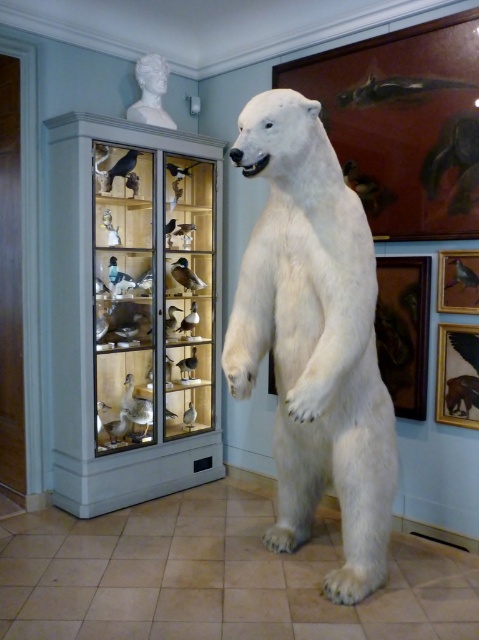
Question: Is white fur polar bear at center further to camera compared to white marble bust at upper center?

Choices:
 (A) no
 (B) yes

Answer: (A)

Question: Is white fur polar bear at center closer to the viewer compared to white marble bust at upper center?

Choices:
 (A) yes
 (B) no

Answer: (A)

Question: Is white fur polar bear at center smaller than white marble bust at upper center?

Choices:
 (A) no
 (B) yes

Answer: (A)

Question: Which point is closer to the camera?

Choices:
 (A) white marble bust at upper center
 (B) white fur polar bear at center

Answer: (B)

Question: Which point is closer to the camera?

Choices:
 (A) tap(345, 458)
 (B) tap(146, 99)

Answer: (A)